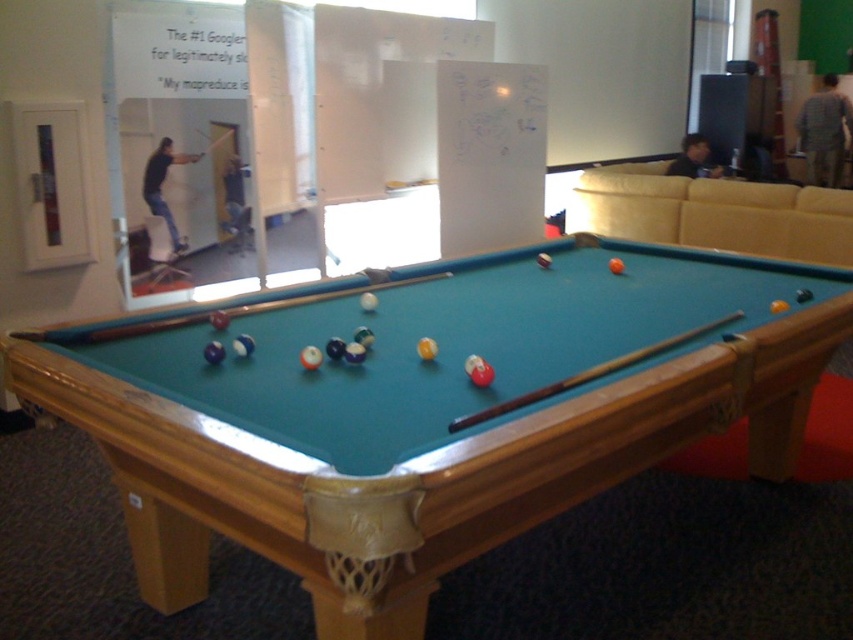
Is teal felt pool table at center smaller than matte black shirt at upper left?

Incorrect, teal felt pool table at center is not smaller in size than matte black shirt at upper left.

Can you confirm if teal felt pool table at center is positioned below matte black shirt at upper left?

Yes.

The width and height of the screenshot is (853, 640). Describe the element at coordinates (430, 412) in the screenshot. I see `teal felt pool table at center` at that location.

In order to click on teal felt pool table at center in this screenshot , I will do `click(430, 412)`.

Does wooden cue at center have a lesser width compared to matte black shirt at upper left?

Incorrect, wooden cue at center's width is not less than matte black shirt at upper left's.

Is wooden cue at center further to camera compared to matte black shirt at upper left?

No, it is not.

The image size is (853, 640). Describe the element at coordinates (590, 372) in the screenshot. I see `wooden cue at center` at that location.

Locate an element on the screen. The width and height of the screenshot is (853, 640). wooden cue at center is located at coordinates (590, 372).

Does point (209, 310) come closer to viewer compared to point (674, 161)?

Yes, it is.

Is point (103, 339) closer to camera compared to point (700, 141)?

Yes, point (103, 339) is in front of point (700, 141).

Where is `wooden smooth cue at center`? This screenshot has width=853, height=640. wooden smooth cue at center is located at coordinates (204, 316).